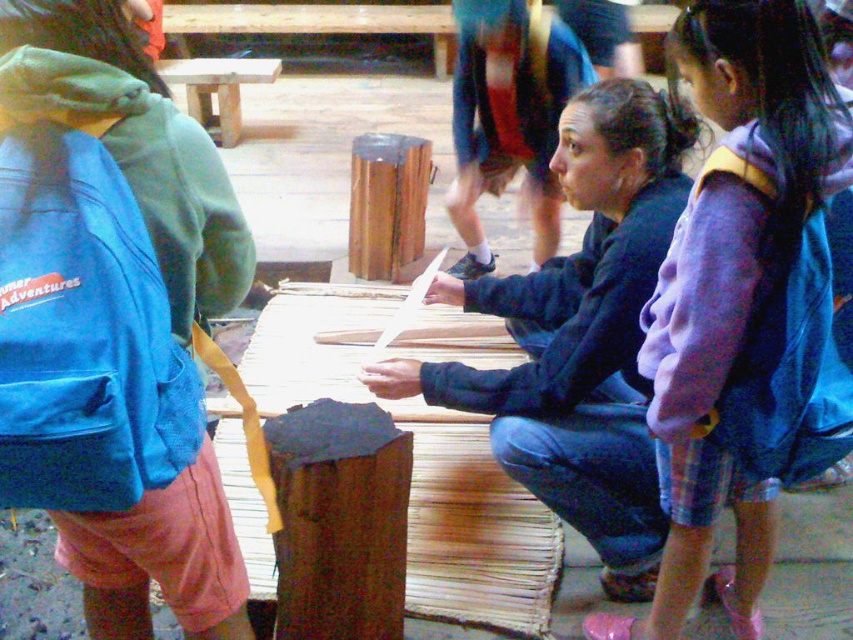
Which is behind, point (563, 324) or point (303, 448)?

Positioned behind is point (563, 324).

Does smooth wooden stool at center have a lesser width compared to dark brown wood at center?

No, smooth wooden stool at center is not thinner than dark brown wood at center.

Where is `smooth wooden stool at center`? Image resolution: width=853 pixels, height=640 pixels. smooth wooden stool at center is located at coordinates (579, 333).

Can you confirm if purple fleece jacket at center is positioned below smooth wooden stool at center?

Yes, purple fleece jacket at center is below smooth wooden stool at center.

Consider the image. Can you confirm if purple fleece jacket at center is bigger than smooth wooden stool at center?

No.

Is point (776, 92) in front of point (564, 381)?

That is True.

Where is `purple fleece jacket at center`? The height and width of the screenshot is (640, 853). purple fleece jacket at center is located at coordinates (744, 307).

Is the position of smooth wooden stool at center less distant than that of purple fleece jacket at upper right?

No.

Does smooth wooden stool at center appear on the left side of purple fleece jacket at upper right?

Indeed, smooth wooden stool at center is positioned on the left side of purple fleece jacket at upper right.

Which is behind, point (431, 285) or point (799, 474)?

The point (431, 285) is behind.

What are the coordinates of `smooth wooden stool at center` in the screenshot? It's located at (579, 333).